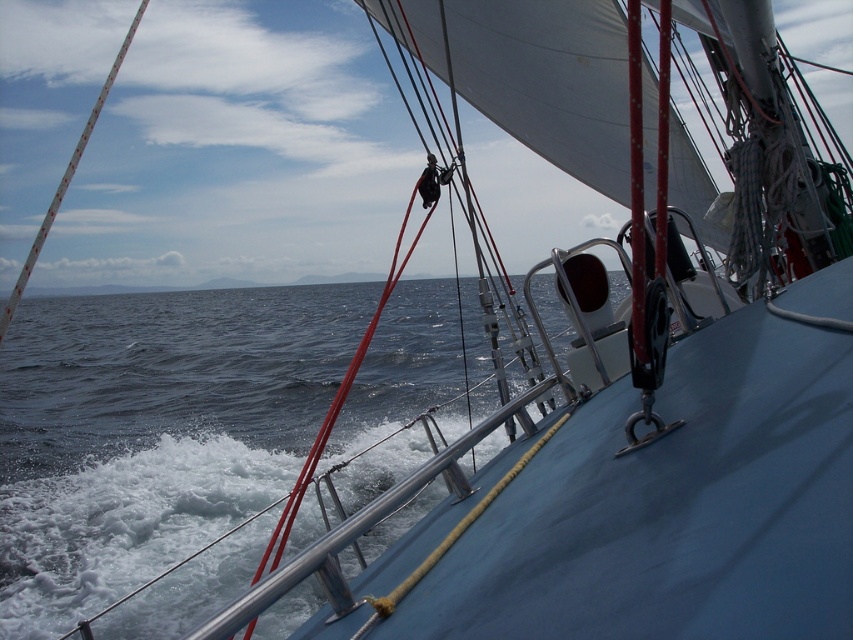
Question: Among these points, which one is nearest to the camera?

Choices:
 (A) (177, 582)
 (B) (125, 35)

Answer: (A)

Question: Observing the image, what is the correct spatial positioning of blue water at lower left in reference to white textured pole at upper left?

Choices:
 (A) left
 (B) right

Answer: (B)

Question: Can you confirm if blue water at lower left is smaller than white textured pole at upper left?

Choices:
 (A) yes
 (B) no

Answer: (A)

Question: Can you confirm if blue water at lower left is bigger than white textured pole at upper left?

Choices:
 (A) no
 (B) yes

Answer: (A)